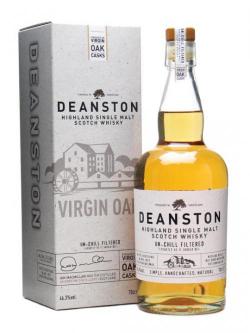
This screenshot has height=333, width=250. Identify the location of box. (67, 65).